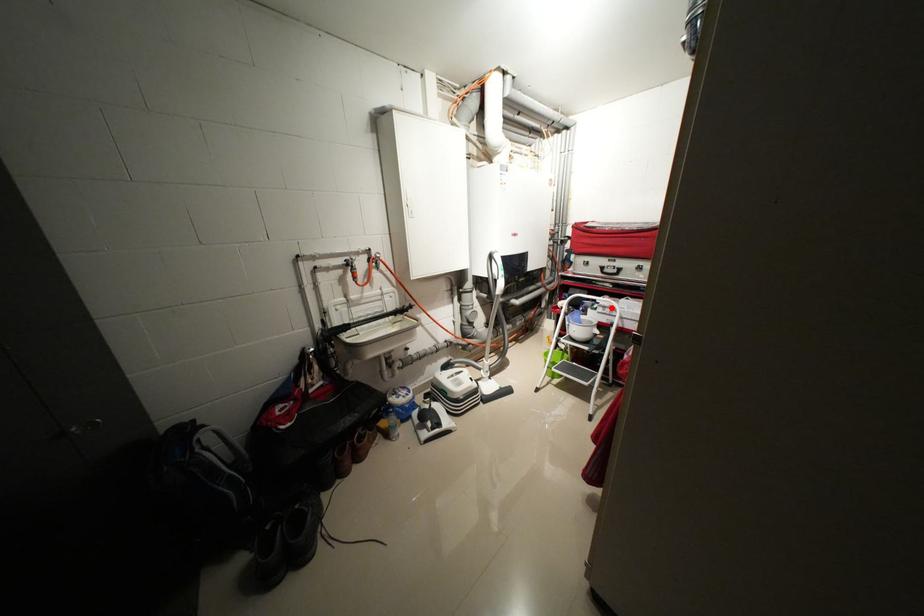
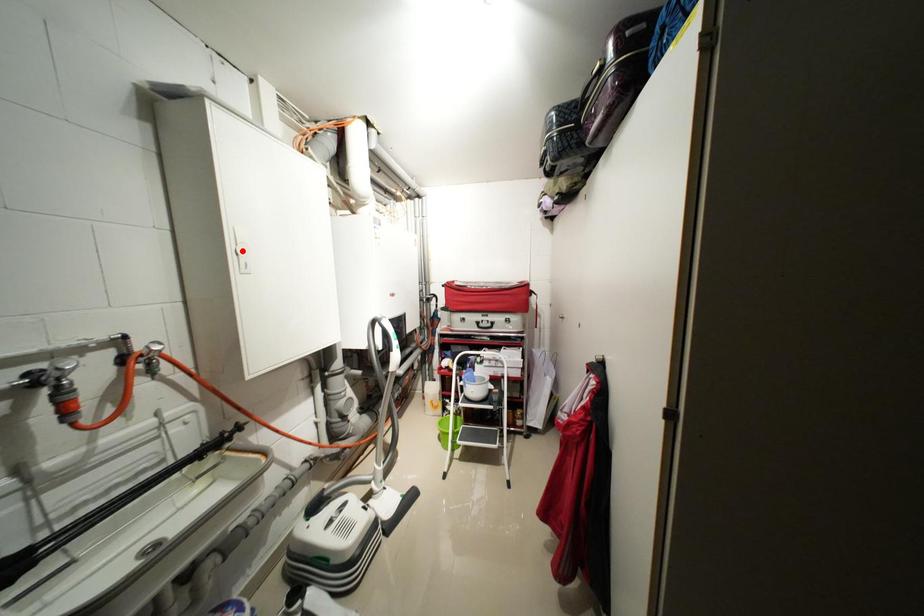
I am providing you with two images of the same scene from different viewpoints. A red point is marked on the first image and another point is marked on the second image. Do the highlighted points in image1 and image2 indicate the same real-world spot?

No